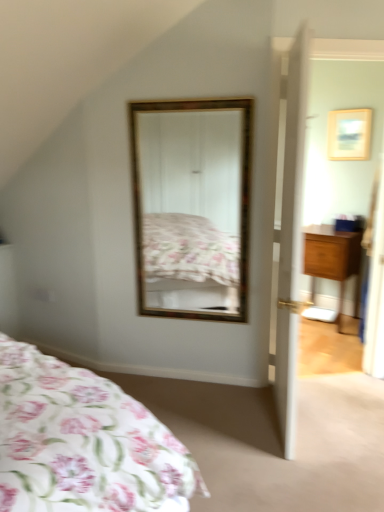
Question: Is point (296, 313) closer or farther from the camera than point (173, 159)?

Choices:
 (A) closer
 (B) farther

Answer: (A)

Question: Considering the positions of white wooden door at right and gold-framed mirror at center in the image, is white wooden door at right wider or thinner than gold-framed mirror at center?

Choices:
 (A) wide
 (B) thin

Answer: (A)

Question: Which object is positioned farthest from the gold-framed mirror at center?

Choices:
 (A) wooden picture frame at upper right
 (B) white wooden door at right
 (C) wooden nightstand at right

Answer: (A)

Question: Which object is positioned closest to the gold-framed mirror at center?

Choices:
 (A) wooden nightstand at right
 (B) wooden picture frame at upper right
 (C) white wooden door at right

Answer: (C)